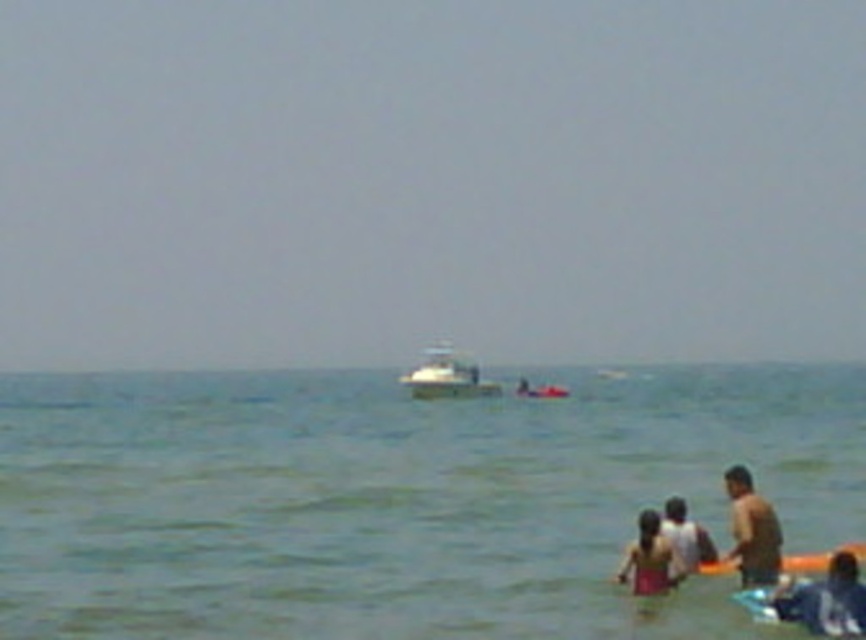
Does pink fabric at lower center have a lesser height compared to white t-shirt at lower right?

No.

Who is more distant from viewer, (638, 531) or (670, 512)?

The point (670, 512) is behind.

I want to click on pink fabric at lower center, so click(648, 557).

Can you confirm if clear blue water at center is wider than pink fabric at lower center?

Yes, clear blue water at center is wider than pink fabric at lower center.

Does point (344, 612) lie behind point (644, 529)?

Yes.

The image size is (866, 640). I want to click on clear blue water at center, so click(399, 499).

Who is taller, blue fabric shirt at lower right or white glossy boat at center?

white glossy boat at center

Looking at this image, which is more to the right, blue fabric shirt at lower right or white glossy boat at center?

Positioned to the right is blue fabric shirt at lower right.

What are the coordinates of `blue fabric shirt at lower right` in the screenshot? It's located at click(x=835, y=600).

The image size is (866, 640). I want to click on blue fabric shirt at lower right, so click(x=835, y=600).